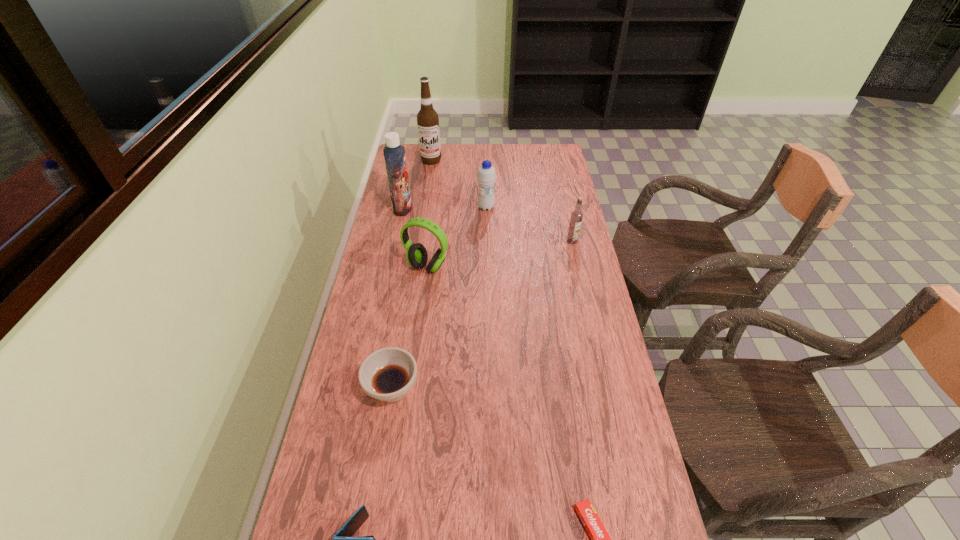
Locate an element on the screen. Image resolution: width=960 pixels, height=540 pixels. free space that is in between the third nearest object and the fourth farthest object is located at coordinates (482, 315).

At what (x,y) coordinates should I click in order to perform the action: click on vacant area between the fifth farthest object and the second tallest object. Please return your answer as a coordinate pair (x, y). The image size is (960, 540). Looking at the image, I should click on (415, 238).

Identify the location of free space between the soup bowl and the shampoo. (397, 299).

At what (x,y) coordinates should I click in order to perform the action: click on the fourth closest object to the soup bowl. Please return your answer as a coordinate pair (x, y). The width and height of the screenshot is (960, 540). Looking at the image, I should click on (394, 154).

The height and width of the screenshot is (540, 960). Find the location of `the seventh closest object to the seventh tallest object`. the seventh closest object to the seventh tallest object is located at coordinates (427, 118).

Locate an element on the screen. Image resolution: width=960 pixels, height=540 pixels. vacant space that satisfies the following two spatial constraints: 1. on the label of the fifth farthest object; 2. on the right side of the farthest object is located at coordinates (416, 267).